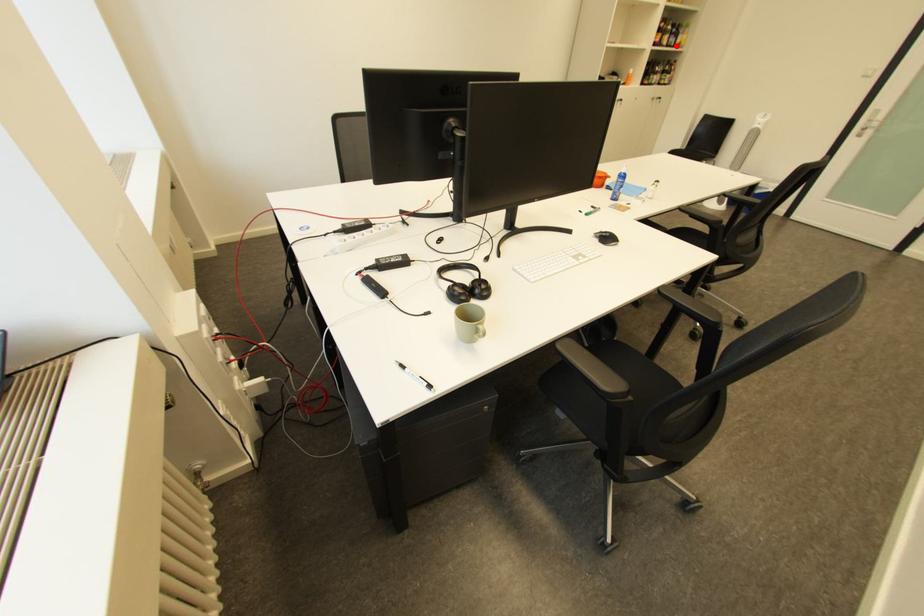
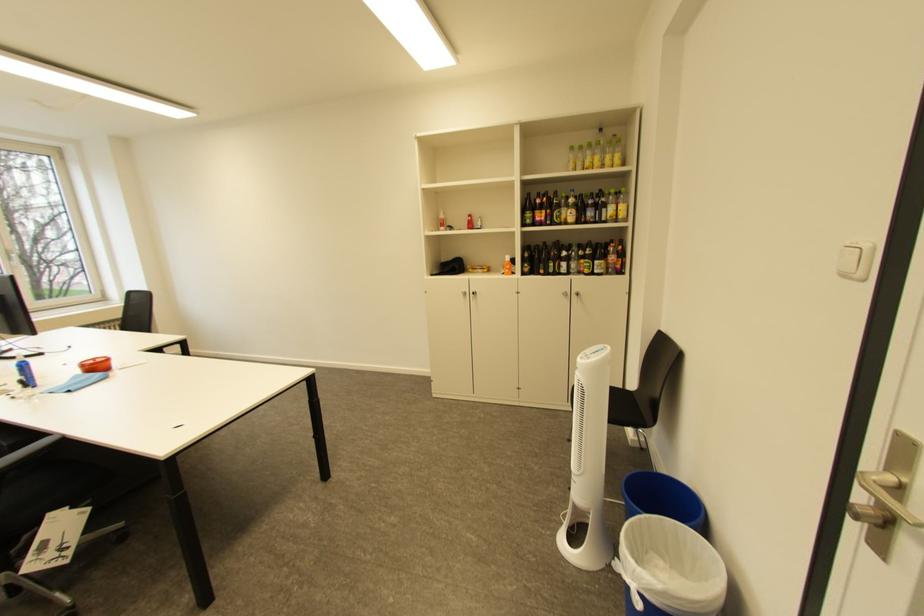
Question: I am providing you with two images of the same scene from different viewpoints. In image1, a red point is highlighted. Considering the same 3D point in image2, which of the following is correct?

Choices:
 (A) It is closer
 (B) It is farther

Answer: (A)